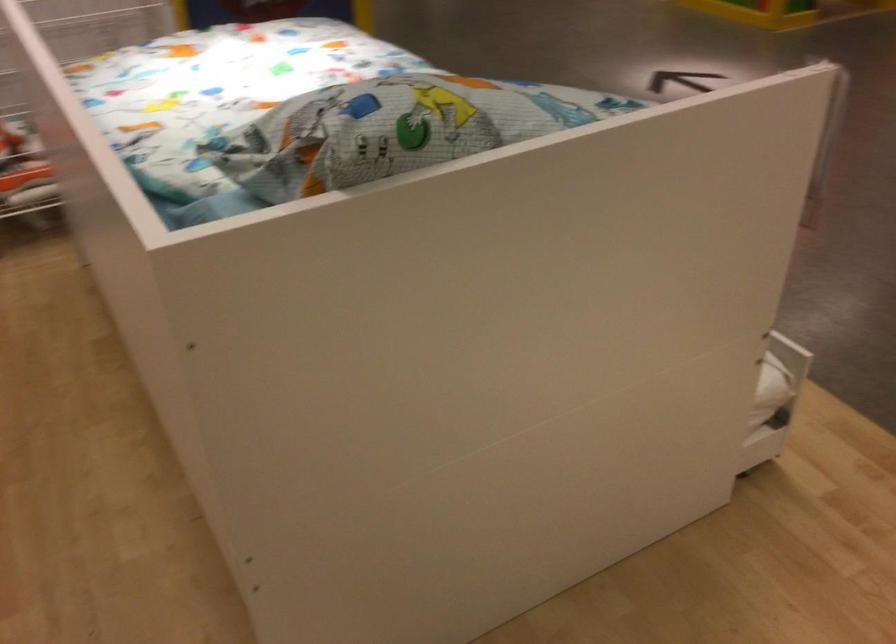
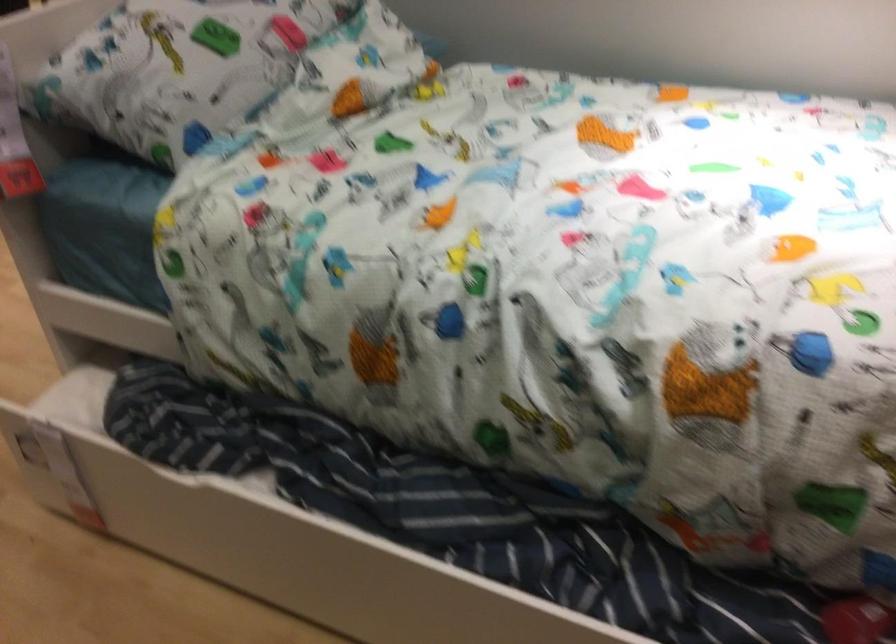
Find the pixel in the second image that matches point (579, 104) in the first image.

(177, 62)